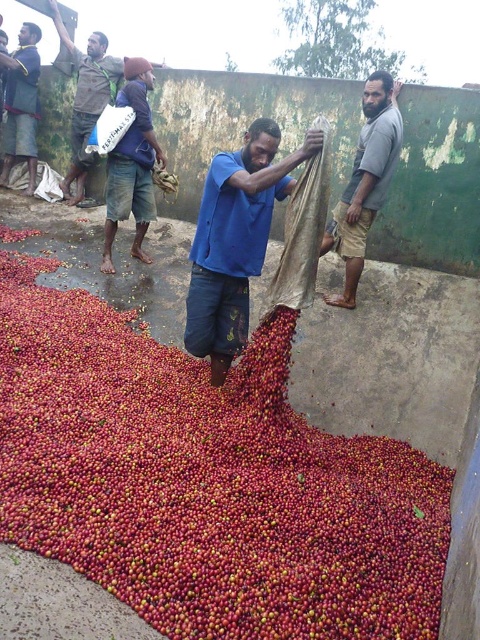
Where is the red matte coffee beans at center located in the image?

The red matte coffee beans at center are located at point (x=205, y=481) in the image.

You are standing in the coffee processing area and need to reach a specific point. Which of the two points, point (135, 403) or point (384, 129), is closer to you?

Point (135, 403) is closer to the viewer than point (384, 129).